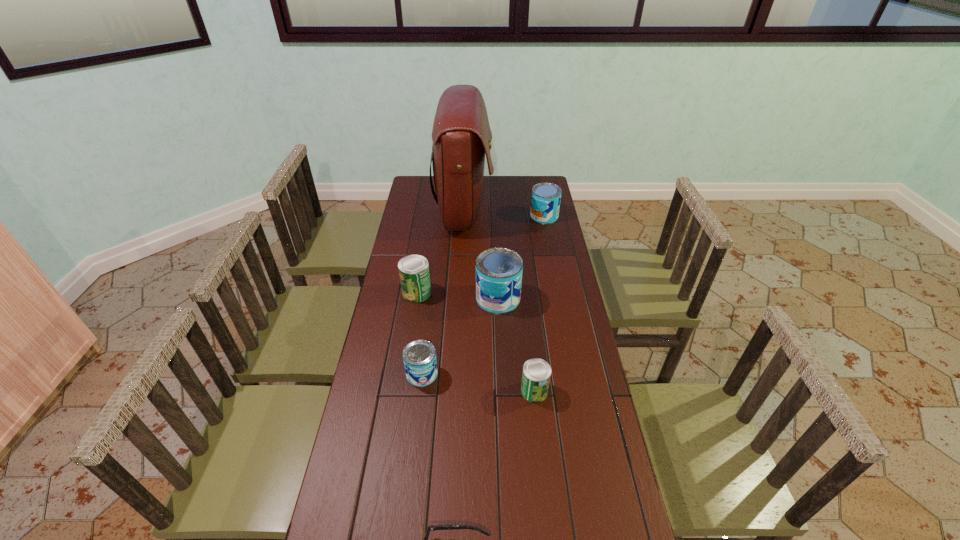
Find the location of `satchel`. satchel is located at coordinates (461, 134).

The height and width of the screenshot is (540, 960). I want to click on brown satchel, so click(461, 134).

Where is `the second blue can from right to left`? Image resolution: width=960 pixels, height=540 pixels. the second blue can from right to left is located at coordinates (499, 271).

The width and height of the screenshot is (960, 540). In order to click on the second tallest object in this screenshot , I will do `click(499, 271)`.

This screenshot has width=960, height=540. In order to click on the rightmost can in this screenshot , I will do 545,201.

Locate an element on the screen. the rightmost blue can is located at coordinates (545, 201).

The image size is (960, 540). What are the coordinates of `the farther green can` in the screenshot? It's located at click(x=414, y=274).

Identify the location of the bigger green can. (414, 274).

Find the location of a particular element. The height and width of the screenshot is (540, 960). the nearest blue can is located at coordinates (419, 356).

Locate an element on the screen. This screenshot has width=960, height=540. the smallest blue can is located at coordinates (419, 356).